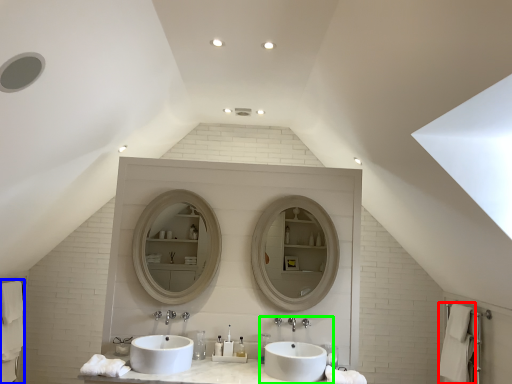
Question: Considering the real-world distances, which object is farthest from bath towel (highlighted by a red box)? bath towel (highlighted by a blue box) or sink (highlighted by a green box)?

Choices:
 (A) bath towel
 (B) sink

Answer: (A)